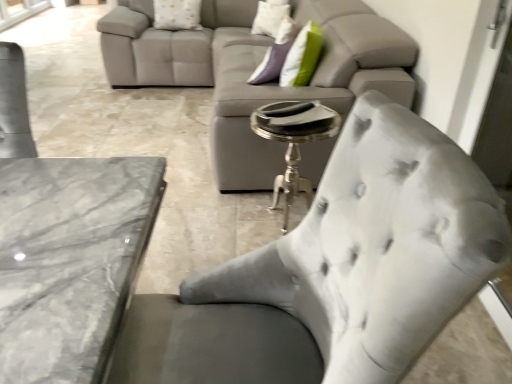
Question: Would you say satin gray chair at lower right is to the left or to the right of white textured pillow at upper center, arranged as the 1th pillow when viewed from the right, in the picture?

Choices:
 (A) left
 (B) right

Answer: (A)

Question: Considering their positions, is satin gray chair at lower right located in front of or behind white textured pillow at upper center, arranged as the 1th pillow when viewed from the right?

Choices:
 (A) behind
 (B) front

Answer: (B)

Question: Which object is the closest to the white textured pillow at upper center, the 2th pillow in the right-to-left sequence?

Choices:
 (A) white textured pillow at upper center, the second pillow when ordered from left to right
 (B) satin gray chair at lower right
 (C) silver metallic side table at center

Answer: (A)

Question: Which is nearer to the satin gray chair at lower right?

Choices:
 (A) silver metallic side table at center
 (B) white textured pillow at upper center, the second pillow when ordered from left to right
 (C) white textured pillow at upper center, the first pillow from the left

Answer: (A)